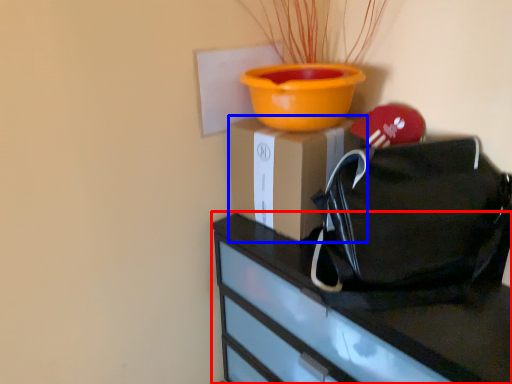
Question: Which of the following is the closest to the observer, furniture (highlighted by a red box) or cardboard box (highlighted by a blue box)?

Choices:
 (A) furniture
 (B) cardboard box

Answer: (A)